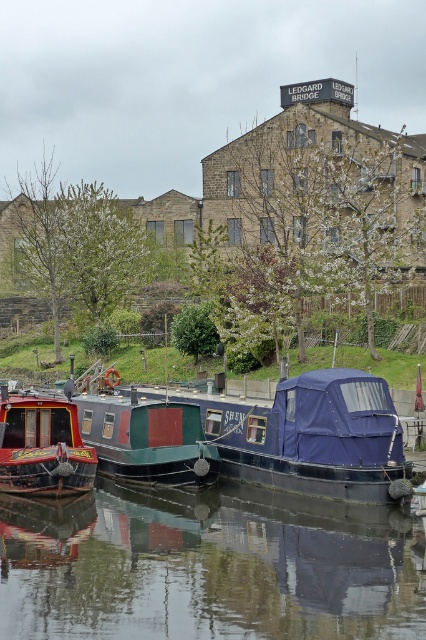
Question: Does blue tarpaulin boat at center appear on the right side of green matte boat at center?

Choices:
 (A) yes
 (B) no

Answer: (A)

Question: Estimate the real-world distances between objects in this image. Which object is closer to the smooth reflective water at center?

Choices:
 (A) green matte boat at center
 (B) blue tarpaulin boat at center
 (C) shiny red boat at left

Answer: (B)

Question: Which point is farther to the camera?

Choices:
 (A) (37, 472)
 (B) (206, 568)
 (C) (201, 404)
 (D) (175, 429)

Answer: (C)

Question: Which of the following is the closest to the observer?

Choices:
 (A) blue tarpaulin boat at center
 (B) shiny red boat at left
 (C) green matte boat at center

Answer: (A)

Question: Does blue tarpaulin boat at center lie behind shiny red boat at left?

Choices:
 (A) yes
 (B) no

Answer: (B)

Question: Is green matte boat at center in front of shiny red boat at left?

Choices:
 (A) yes
 (B) no

Answer: (A)